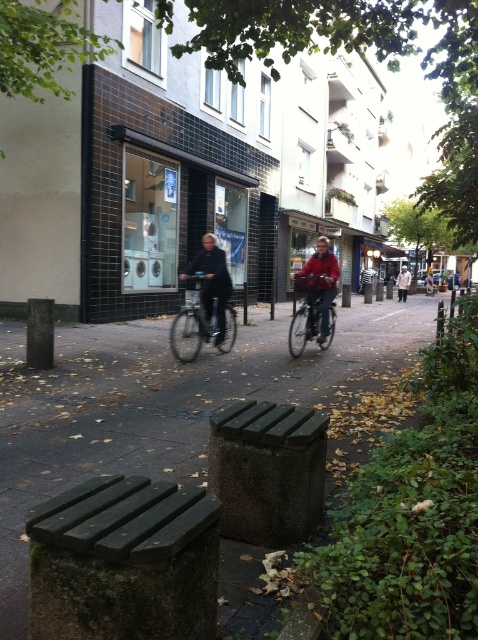
You are standing on the sidewalk and want to park your bicycle. The point where you want to park is at coordinates point [199,324]. Is there space to park your bicycle there?

The matte black bicycle at center is located at point [199,324], so there is no space to park your bicycle there as the spot is already occupied.

You are a delivery person who needs to place a package on the ground between the red matte jacket at center and the metallic silver bicycle at center. Can you fit the package there?

The red matte jacket at center is positioned on the right side of the metallic silver bicycle at center, so there is space between them to place the package.

You are standing on the sidewalk and want to take a photo of both point (97,516) and point (207,240) in the scene. Since you can only focus on one point at a time, which point should you focus on to ensure both are in focus?

You should focus on point (207,240) because it is farther away from the camera than point (97,516). By focusing on the farther point, the depth of field will include the closer point as well, ensuring both are in focus.